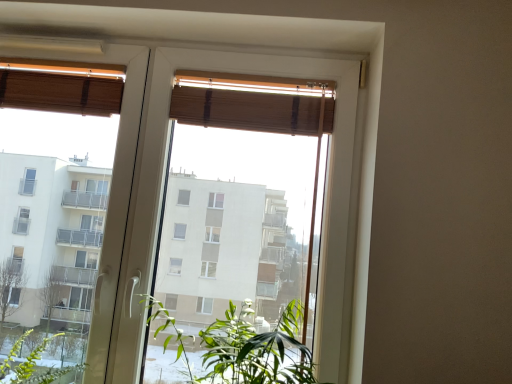
Question: Can you confirm if wooden blind at upper center, which is the 2th curtain in left-to-right order, is smaller than wooden blinds at upper center?

Choices:
 (A) no
 (B) yes

Answer: (B)

Question: Can you confirm if wooden blind at upper center, which is the 2th curtain in left-to-right order, is positioned to the left of wooden blinds at upper center?

Choices:
 (A) yes
 (B) no

Answer: (B)

Question: Considering the relative sizes of wooden blind at upper center, which is the 2th curtain in left-to-right order, and wooden blinds at upper center in the image provided, is wooden blind at upper center, which is the 2th curtain in left-to-right order, thinner than wooden blinds at upper center?

Choices:
 (A) yes
 (B) no

Answer: (A)

Question: Considering the relative positions of wooden blind at upper center, which is the 1th curtain from right to left, and wooden blinds at upper center in the image provided, is wooden blind at upper center, which is the 1th curtain from right to left, to the right of wooden blinds at upper center from the viewer's perspective?

Choices:
 (A) yes
 (B) no

Answer: (A)

Question: Considering the relative sizes of wooden blind at upper center, which is the 1th curtain from right to left, and wooden blinds at upper center in the image provided, is wooden blind at upper center, which is the 1th curtain from right to left, bigger than wooden blinds at upper center?

Choices:
 (A) no
 (B) yes

Answer: (A)

Question: From a real-world perspective, is wooden blind at upper center, which is the 2th curtain in left-to-right order, physically below wooden blinds at upper center?

Choices:
 (A) no
 (B) yes

Answer: (A)

Question: Is wooden blind at upper center, which is the 1th curtain from right to left, at the left side of green leafy plant at center?

Choices:
 (A) no
 (B) yes

Answer: (A)

Question: Does wooden blind at upper center, which is the 2th curtain in left-to-right order, turn towards green leafy plant at center?

Choices:
 (A) no
 (B) yes

Answer: (A)

Question: Is wooden blind at upper center, which is the 2th curtain in left-to-right order, further to the viewer compared to green leafy plant at center?

Choices:
 (A) yes
 (B) no

Answer: (A)

Question: Is wooden blind at upper center, which is the 2th curtain in left-to-right order, next to green leafy plant at center?

Choices:
 (A) no
 (B) yes

Answer: (A)

Question: Is wooden blind at upper center, which is the 1th curtain from right to left, in front of green leafy plant at center?

Choices:
 (A) no
 (B) yes

Answer: (A)

Question: Is there a large distance between wooden blind at upper center, which is the 1th curtain from right to left, and green leafy plant at center?

Choices:
 (A) no
 (B) yes

Answer: (A)

Question: Considering the relative positions of wooden blinds at upper center and wooden blind at upper center, which is the 1th curtain from right to left, in the image provided, is wooden blinds at upper center to the left of wooden blind at upper center, which is the 1th curtain from right to left, from the viewer's perspective?

Choices:
 (A) no
 (B) yes

Answer: (B)